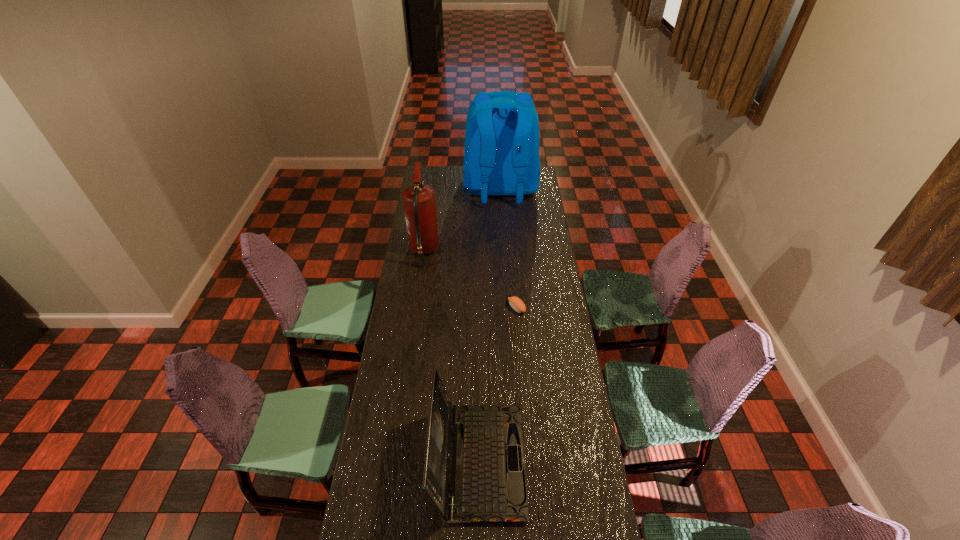
The height and width of the screenshot is (540, 960). In order to click on vacant space that satisfies the following two spatial constraints: 1. on the front side of the sushi; 2. on the screen of the nearest object in this screenshot , I will do `click(529, 461)`.

Image resolution: width=960 pixels, height=540 pixels. In order to click on vacant space that satisfies the following two spatial constraints: 1. on the back of the farthest object; 2. on the screen of the nearest object in this screenshot , I will do `click(516, 461)`.

Locate an element on the screen. This screenshot has width=960, height=540. vacant space that satisfies the following two spatial constraints: 1. on the front side of the third farthest object; 2. on the screen of the second shortest object is located at coordinates (529, 461).

Where is `vacant point that satisfies the following two spatial constraints: 1. on the back of the sushi; 2. on the left side of the farthest object`? This screenshot has height=540, width=960. vacant point that satisfies the following two spatial constraints: 1. on the back of the sushi; 2. on the left side of the farthest object is located at coordinates point(508,308).

Where is `vacant space that satisfies the following two spatial constraints: 1. on the back of the tallest object; 2. on the right side of the second nearest object`? The image size is (960, 540). vacant space that satisfies the following two spatial constraints: 1. on the back of the tallest object; 2. on the right side of the second nearest object is located at coordinates (508, 308).

Where is `free space in the image that satisfies the following two spatial constraints: 1. on the back side of the sushi; 2. at the front of the fire extinguisher where the nozzle is aimed`? The width and height of the screenshot is (960, 540). free space in the image that satisfies the following two spatial constraints: 1. on the back side of the sushi; 2. at the front of the fire extinguisher where the nozzle is aimed is located at coordinates (512, 251).

The image size is (960, 540). I want to click on vacant point that satisfies the following two spatial constraints: 1. at the front of the third nearest object where the nozzle is aimed; 2. on the back side of the second nearest object, so click(416, 308).